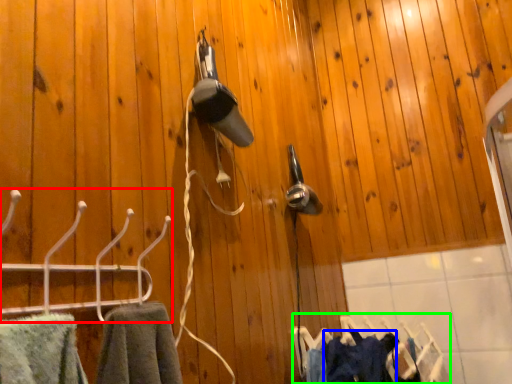
Question: Which object is positioned closest to hanger (highlighted by a red box)? Select from clothing (highlighted by a blue box) and laundry (highlighted by a green box).

Choices:
 (A) clothing
 (B) laundry

Answer: (A)